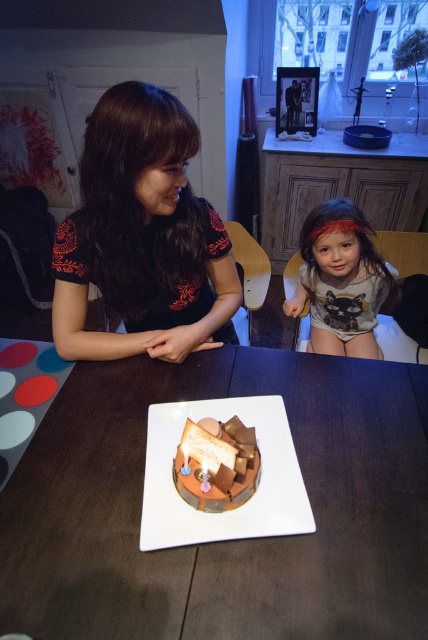
You are a guest at a birthday party and want to take a photo of the smooth wooden table at center and the chocolatesmoothcake at center. Which object should you focus on first to ensure both are in frame?

You should focus on the smooth wooden table at center first because it is positioned under the chocolatesmoothcake at center, so adjusting the camera angle to include the table will naturally include the cake as well.